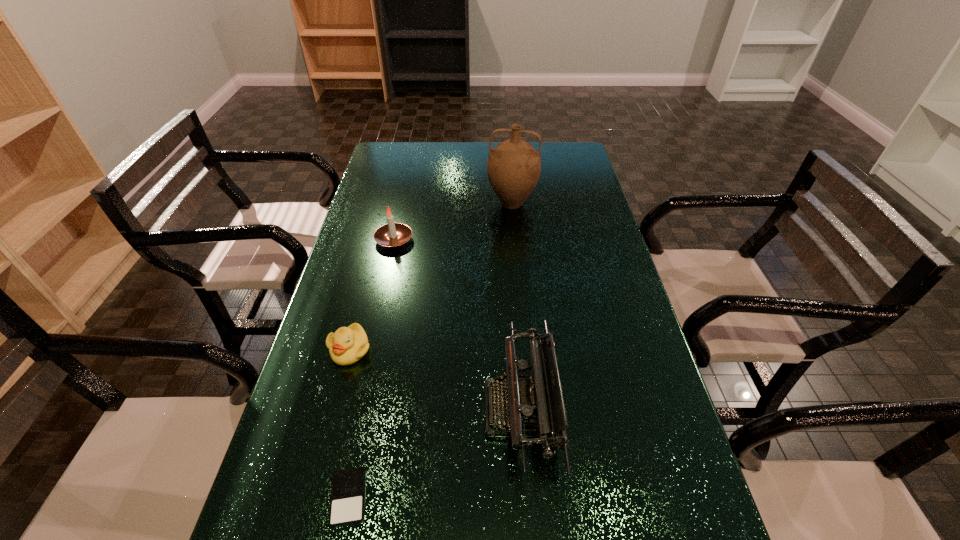
What are the coordinates of `the tallest object` in the screenshot? It's located at (514, 166).

Where is `pitcher`? The height and width of the screenshot is (540, 960). pitcher is located at coordinates (514, 166).

Locate an element on the screen. This screenshot has height=540, width=960. candle is located at coordinates (392, 235).

Locate an element on the screen. This screenshot has width=960, height=540. typewriter is located at coordinates (536, 400).

Where is `the fourth tallest object`? This screenshot has width=960, height=540. the fourth tallest object is located at coordinates (347, 345).

Locate an element on the screen. The image size is (960, 540). iPod is located at coordinates (347, 501).

This screenshot has width=960, height=540. In order to click on vacant position located on the front of the tallest object in this screenshot , I will do `click(517, 261)`.

At what (x,y) coordinates should I click in order to perform the action: click on free space located on the back of the fourth nearest object. Please return your answer as a coordinate pair (x, y). Looking at the image, I should click on (405, 190).

Find the location of a particular element. The width and height of the screenshot is (960, 540). vacant area situated on the typing side of the typewriter is located at coordinates (383, 409).

Locate an element on the screen. This screenshot has height=540, width=960. free point located 0.270m on the typing side of the typewriter is located at coordinates (365, 409).